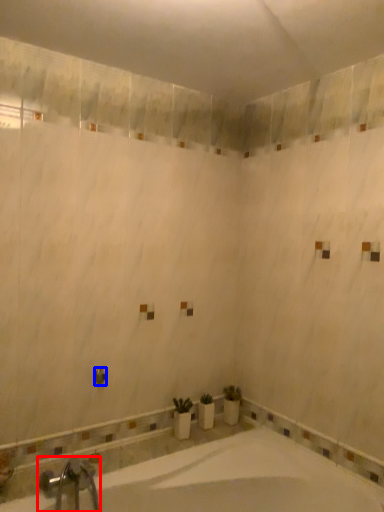
Question: Which of the following is the closest to the observer, tap (highlighted by a red box) or shower (highlighted by a blue box)?

Choices:
 (A) tap
 (B) shower

Answer: (A)